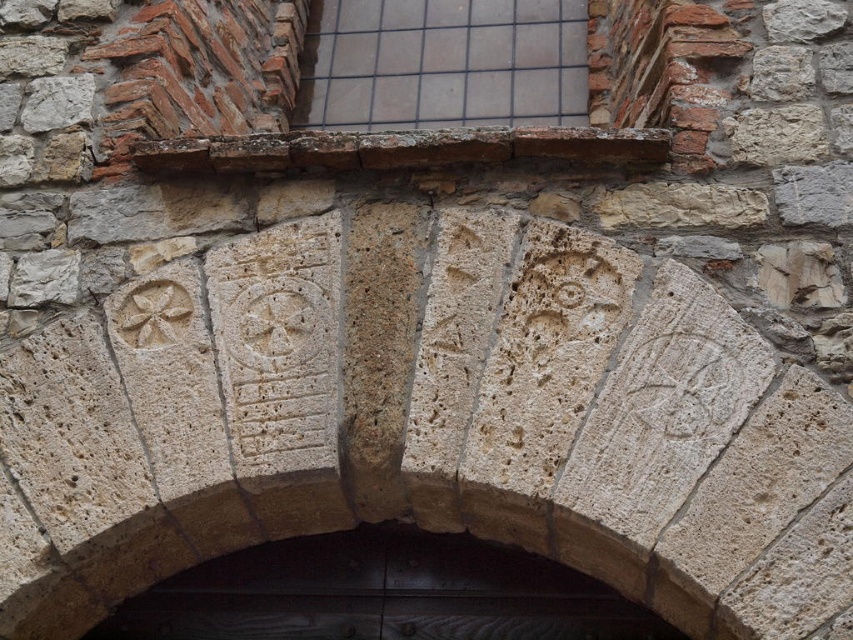
Which is more to the right, dark wood door at center or clear glass window at upper center?

clear glass window at upper center

At what (x,y) coordinates should I click in order to perform the action: click on dark wood door at center. Please return your answer as a coordinate pair (x, y). The height and width of the screenshot is (640, 853). Looking at the image, I should click on (381, 595).

Is point (129, 598) positioned behind point (527, 10)?

That is False.

In order to click on dark wood door at center in this screenshot , I will do [381, 595].